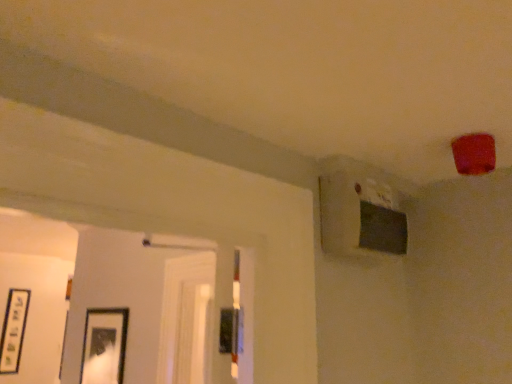
Question: Is matte black picture frame at lower left, positioned as the 1th picture frame in top-to-bottom order, inside the boundaries of black matte picture frame at lower left, placed as the second picture frame when sorted from right to left, or outside?

Choices:
 (A) inside
 (B) outside

Answer: (B)

Question: Visually, is matte black picture frame at lower left, the 2th picture frame when ordered from left to right, positioned to the left or to the right of black matte picture frame at lower left, which appears as the 2th picture frame when viewed from the front?

Choices:
 (A) right
 (B) left

Answer: (A)

Question: Is point (81, 377) closer or farther from the camera than point (16, 357)?

Choices:
 (A) closer
 (B) farther

Answer: (A)

Question: Based on their sizes in the image, would you say black matte picture frame at lower left, marked as the 2th picture frame in a top-to-bottom arrangement, is bigger or smaller than matte black picture frame at lower left, the 2th picture frame when ordered from left to right?

Choices:
 (A) small
 (B) big

Answer: (A)

Question: In terms of height, does black matte picture frame at lower left, which appears as the 2th picture frame when viewed from the front, look taller or shorter compared to matte black picture frame at lower left, placed as the 2th picture frame when sorted from bottom to top?

Choices:
 (A) tall
 (B) short

Answer: (A)

Question: Is black matte picture frame at lower left, placed as the second picture frame when sorted from right to left, to the left or to the right of matte black picture frame at lower left, the 1th picture frame when ordered from right to left, in the image?

Choices:
 (A) right
 (B) left

Answer: (B)

Question: Is black matte picture frame at lower left, placed as the second picture frame when sorted from right to left, inside the boundaries of matte black picture frame at lower left, the 1th picture frame when ordered from right to left, or outside?

Choices:
 (A) inside
 (B) outside

Answer: (B)